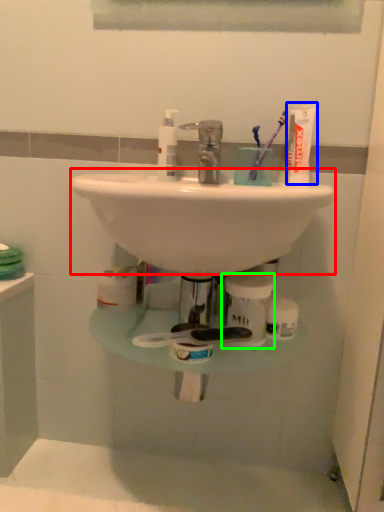
Question: Considering the real-world distances, which object is farthest from sink (highlighted by a red box)? toothpaste (highlighted by a blue box) or toiletry (highlighted by a green box)?

Choices:
 (A) toothpaste
 (B) toiletry

Answer: (A)